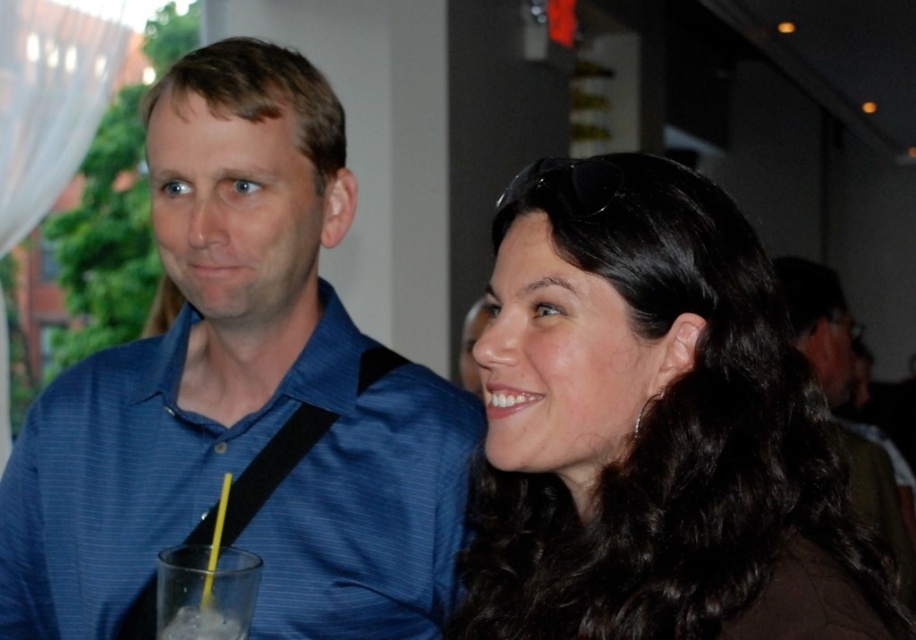
Is point (443, 488) closer to viewer compared to point (878, 556)?

No, (443, 488) is further to viewer.

Which is in front, point (23, 532) or point (829, 536)?

Point (829, 536)

Identify the location of blue striped shirt at left. (240, 392).

Who is lower down, blue striped shirt at left or green fabric shirt at upper right?

green fabric shirt at upper right is lower down.

Is blue striped shirt at left bigger than green fabric shirt at upper right?

No, blue striped shirt at left is not bigger than green fabric shirt at upper right.

The image size is (916, 640). I want to click on blue striped shirt at left, so pos(240,392).

Identify the location of blue striped shirt at left. Image resolution: width=916 pixels, height=640 pixels. (240, 392).

From the picture: Which of these two, blue striped shirt at left or clear plastic cup at lower left, stands shorter?

clear plastic cup at lower left

Where is `blue striped shirt at left`? The width and height of the screenshot is (916, 640). blue striped shirt at left is located at coordinates (240, 392).